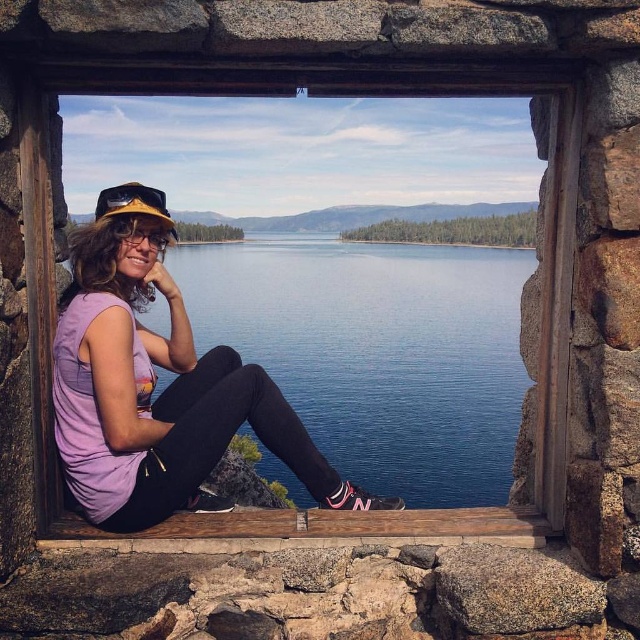
Which is more to the right, blue water at center or wooden at center?

blue water at center

Is point (413, 442) behind point (330, 84)?

That is True.

The width and height of the screenshot is (640, 640). Find the location of `blue water at center`. blue water at center is located at coordinates (378, 353).

The width and height of the screenshot is (640, 640). What are the coordinates of `blue water at center` in the screenshot? It's located at (378, 353).

Does point (538, 390) come farther from viewer compared to point (108, 193)?

Yes, point (538, 390) is farther from viewer.

Who is taller, wooden at center or matte yellow baseball cap at left?

matte yellow baseball cap at left

Which is in front, point (38, 99) or point (145, 200)?

Positioned in front is point (38, 99).

Identify the location of wooden at center. Image resolution: width=640 pixels, height=640 pixels. (540, 340).

Does purple fabric shirt at center appear under matte yellow baseball cap at left?

Correct, purple fabric shirt at center is located below matte yellow baseball cap at left.

Does purple fabric shirt at center have a greater height compared to matte yellow baseball cap at left?

No.

Locate an element on the screen. Image resolution: width=640 pixels, height=640 pixels. purple fabric shirt at center is located at coordinates (160, 394).

You are a GUI agent. You are given a task and a screenshot of the screen. Output one action in this format:
    pyautogui.click(x=<x>, y=<y>)
    Task: Click on the purple fabric shirt at center
    
    Given the screenshot: What is the action you would take?
    pyautogui.click(x=160, y=394)